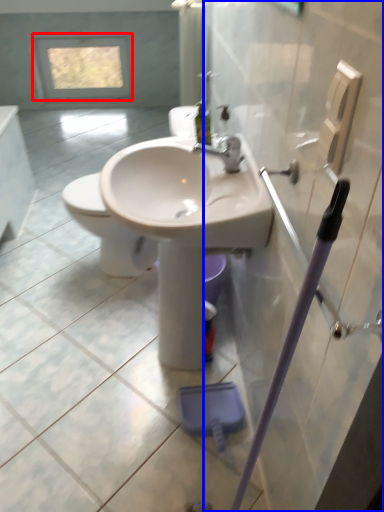
Question: Which object is further to the camera taking this photo, window (highlighted by a red box) or screen door (highlighted by a blue box)?

Choices:
 (A) window
 (B) screen door

Answer: (A)